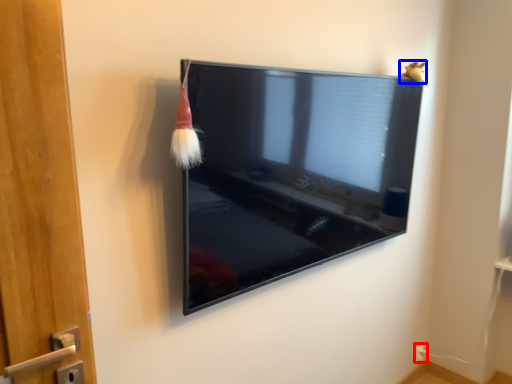
Question: Which point is closer to the camera, electric outlet (highlighted by a red box) or animal (highlighted by a blue box)?

Choices:
 (A) electric outlet
 (B) animal

Answer: (B)